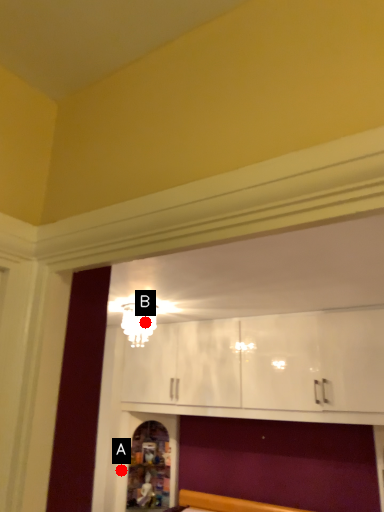
Question: Two points are circled on the image, labeled by A and B beside each circle. Which point appears farthest from the camera in this image?

Choices:
 (A) A is further
 (B) B is further

Answer: (A)